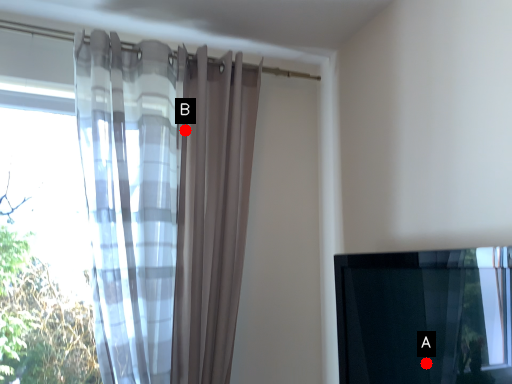
Question: Two points are circled on the image, labeled by A and B beside each circle. Which point is farther from the camera taking this photo?

Choices:
 (A) A is further
 (B) B is further

Answer: (B)